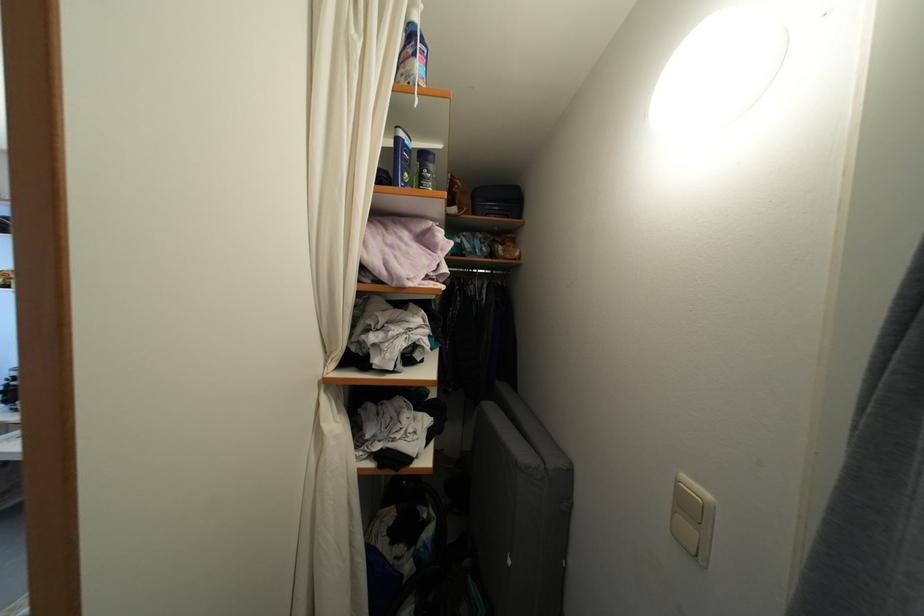
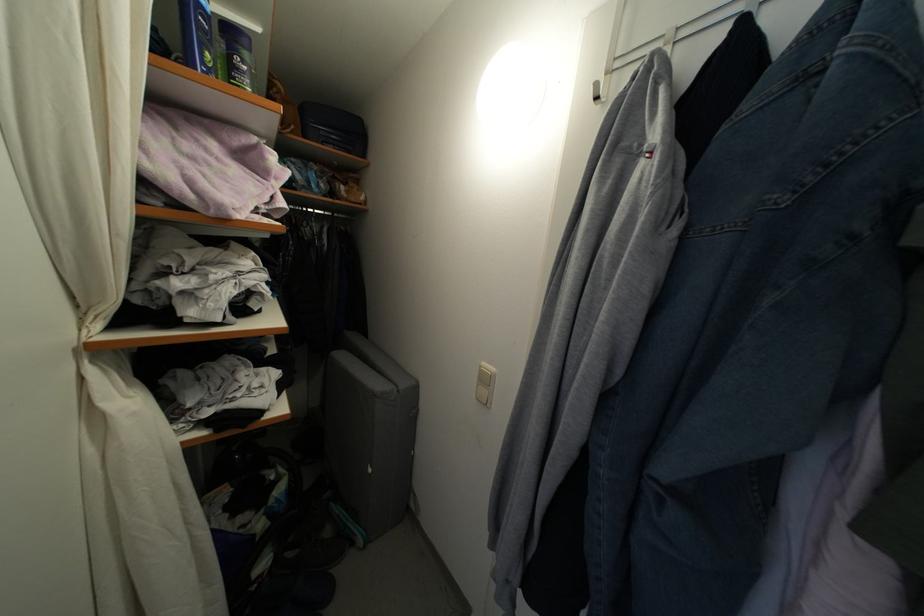
Where in the second image is the point corresponding to (x=689, y=483) from the first image?

(489, 370)